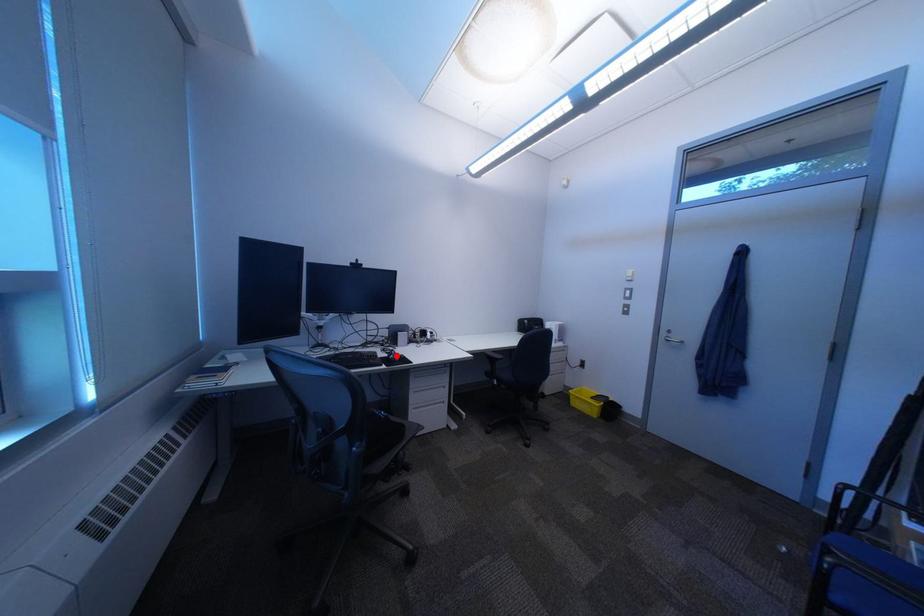
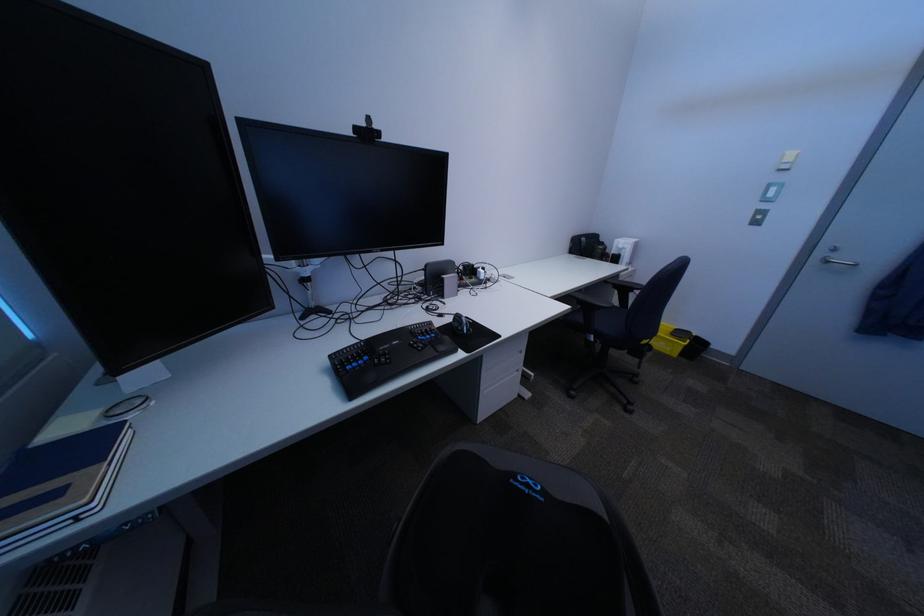
The point at the highlighted location is marked in the first image. Where is the corresponding point in the second image?

(454, 325)